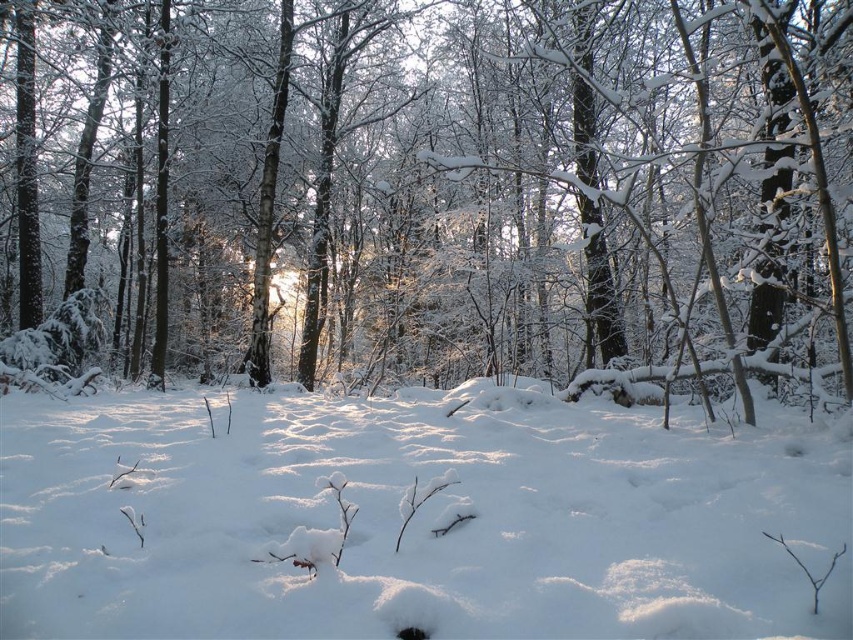
Question: Which point appears closest to the camera in this image?

Choices:
 (A) (218, 248)
 (B) (22, 547)

Answer: (B)

Question: Is white snow-covered tree at center above white fluffy snow at center?

Choices:
 (A) no
 (B) yes

Answer: (B)

Question: Which of the following is the closest to the observer?

Choices:
 (A) white snow-covered tree at center
 (B) white fluffy snow at center

Answer: (B)

Question: Which point is farther to the camera?

Choices:
 (A) (793, 468)
 (B) (305, 157)

Answer: (B)

Question: From the image, what is the correct spatial relationship of white snow-covered tree at center in relation to white fluffy snow at center?

Choices:
 (A) below
 (B) above

Answer: (B)

Question: Is white snow-covered tree at center bigger than white fluffy snow at center?

Choices:
 (A) yes
 (B) no

Answer: (A)